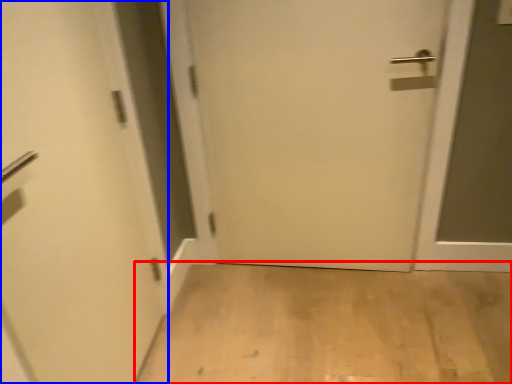
Question: Among these objects, which one is nearest to the camera, corridor (highlighted by a red box) or door (highlighted by a blue box)?

Choices:
 (A) corridor
 (B) door

Answer: (B)